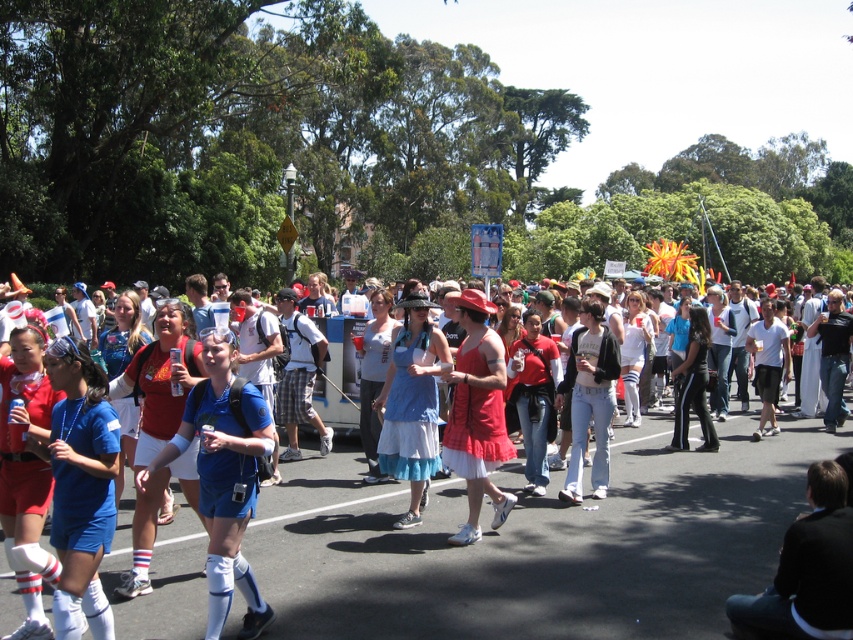
Question: Does black fabric jacket at lower right appear under matte red dress at center?

Choices:
 (A) yes
 (B) no

Answer: (A)

Question: Considering the relative positions of black fabric jacket at lower right and blue cotton dress at center in the image provided, where is black fabric jacket at lower right located with respect to blue cotton dress at center?

Choices:
 (A) right
 (B) left

Answer: (A)

Question: Which of the following is the closest to the observer?

Choices:
 (A) (825, 472)
 (B) (485, 468)
 (C) (268, 412)
 (D) (405, 349)

Answer: (A)

Question: Which of the following is the farthest from the observer?

Choices:
 (A) blue cotton dress at center
 (B) matte red dress at center
 (C) blue fabric dress at center

Answer: (A)

Question: Is blue fabric dress at center smaller than blue cotton dress at center?

Choices:
 (A) yes
 (B) no

Answer: (A)

Question: Which of these objects is positioned closest to the matte red dress at center?

Choices:
 (A) black fabric jacket at lower right
 (B) blue fabric shorts at center
 (C) blue cotton dress at center

Answer: (C)